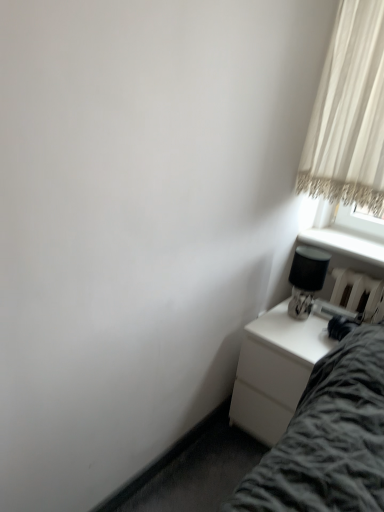
The height and width of the screenshot is (512, 384). Identify the location of vacant space situated above white glossy nightstand at lower right (from a real-world perspective). (313, 320).